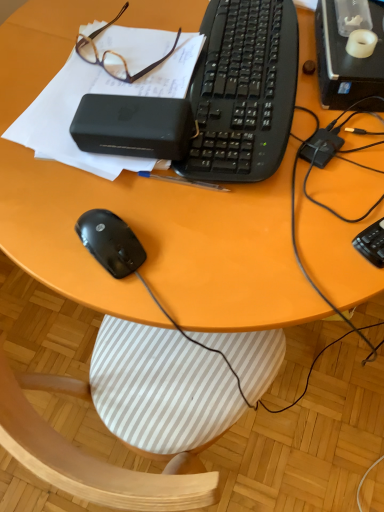
Question: Choose the correct answer: Is black plastic keyboard at center, positioned as the 2th computer keyboard in front-to-back order, inside black matte notepad at upper left or outside it?

Choices:
 (A) inside
 (B) outside

Answer: (B)

Question: In the image, is black plastic keyboard at center, positioned as the 2th computer keyboard in front-to-back order, on the left side or the right side of black matte notepad at upper left?

Choices:
 (A) right
 (B) left

Answer: (A)

Question: Which object is positioned farthest from the black plastic keyboard at right, the first computer keyboard positioned from the bottom?

Choices:
 (A) brown plastic glasses at upper left
 (B) black plastic power bank at upper center
 (C) black plastic desktop computer at upper right
 (D) black matte mouse at lower left
 (E) black plastic keyboard at center, which appears as the 1th computer keyboard when viewed from the back

Answer: (A)

Question: Based on their relative distances, which object is nearer to the black matte notepad at upper left?

Choices:
 (A) black plastic power bank at upper center
 (B) black plastic keyboard at right, which ranks as the second computer keyboard in top-to-bottom order
 (C) black matte mouse at lower left
 (D) brown plastic glasses at upper left
 (E) black plastic desktop computer at upper right

Answer: (D)